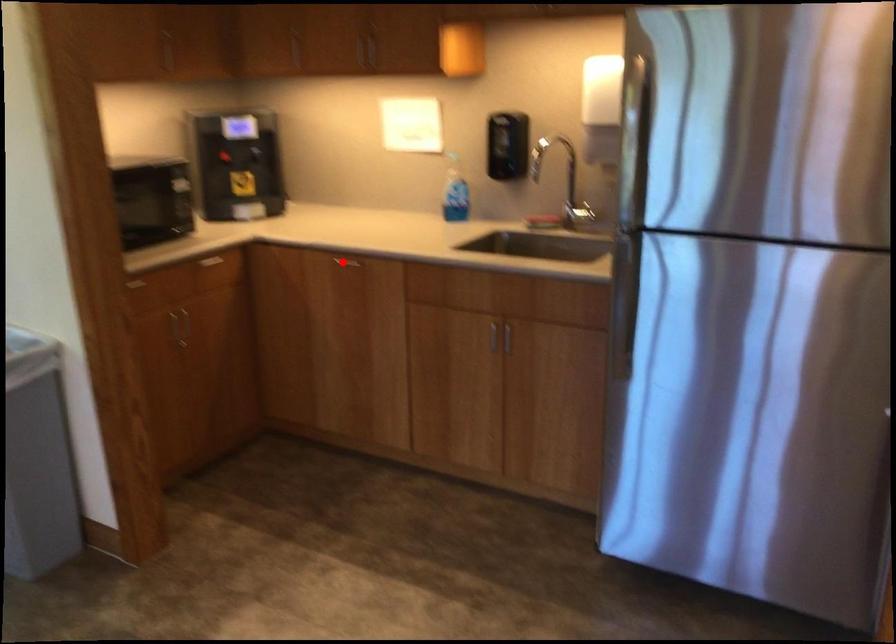
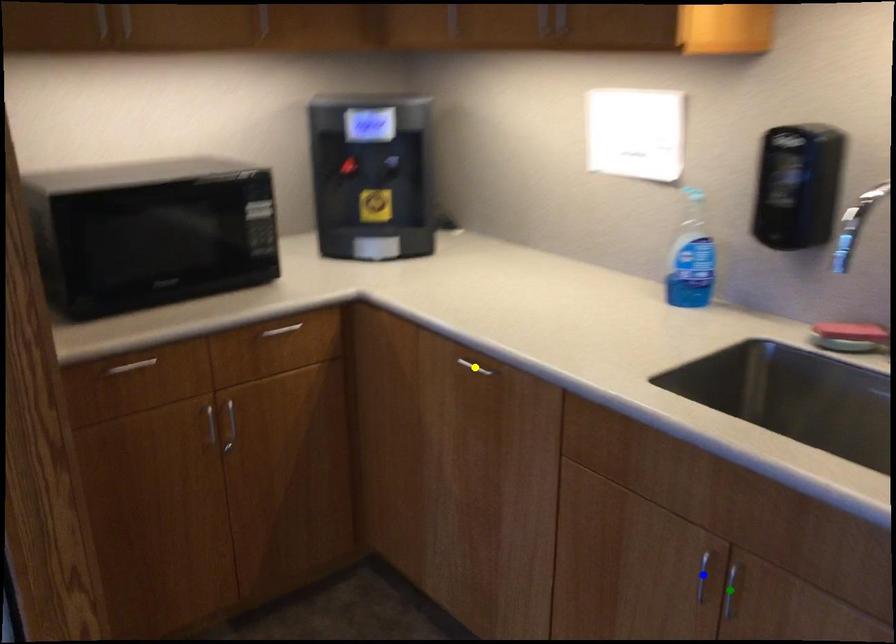
Question: I am providing you with two images of the same scene from different viewpoints. A red point is marked on the first image. You are given multiple points on the second image. Which mark in image 2 goes with the point in image 1?

Choices:
 (A) green point
 (B) yellow point
 (C) blue point

Answer: (B)